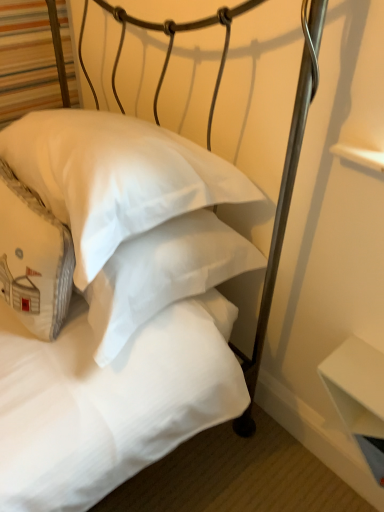
Question: From a real-world perspective, is white cotton pillow at center, marked as the 1th pillow in a left-to-right arrangement, physically below white matte pillow at center, the 1th pillow from the right?

Choices:
 (A) yes
 (B) no

Answer: (A)

Question: From the image's perspective, does white cotton pillow at center, which is the second pillow from right to left, appear higher than white matte pillow at center, placed as the 2th pillow when sorted from left to right?

Choices:
 (A) yes
 (B) no

Answer: (B)

Question: From the image's perspective, is white cotton pillow at center, marked as the 1th pillow in a left-to-right arrangement, under white matte pillow at center, placed as the 2th pillow when sorted from left to right?

Choices:
 (A) yes
 (B) no

Answer: (A)

Question: From a real-world perspective, does white cotton pillow at center, marked as the 1th pillow in a left-to-right arrangement, stand above white matte pillow at center, placed as the 2th pillow when sorted from left to right?

Choices:
 (A) yes
 (B) no

Answer: (B)

Question: Could white matte pillow at center, placed as the 2th pillow when sorted from left to right, be considered to be inside white cotton pillow at center, marked as the 1th pillow in a left-to-right arrangement?

Choices:
 (A) yes
 (B) no

Answer: (B)

Question: Considering the relative positions of white cotton pillow at center, marked as the 1th pillow in a left-to-right arrangement, and white matte pillow at center, placed as the 2th pillow when sorted from left to right, in the image provided, is white cotton pillow at center, marked as the 1th pillow in a left-to-right arrangement, to the right of white matte pillow at center, placed as the 2th pillow when sorted from left to right, from the viewer's perspective?

Choices:
 (A) no
 (B) yes

Answer: (A)

Question: Is white matte table at lower right next to white matte pillow at center, placed as the 2th pillow when sorted from left to right?

Choices:
 (A) yes
 (B) no

Answer: (B)

Question: From the image's perspective, does white matte table at lower right appear higher than white matte pillow at center, the 1th pillow from the right?

Choices:
 (A) no
 (B) yes

Answer: (A)

Question: From a real-world perspective, is white matte table at lower right positioned over white matte pillow at center, placed as the 2th pillow when sorted from left to right, based on gravity?

Choices:
 (A) yes
 (B) no

Answer: (B)

Question: Can you confirm if white matte table at lower right is wider than white matte pillow at center, the 1th pillow from the right?

Choices:
 (A) yes
 (B) no

Answer: (B)

Question: Is the position of white matte table at lower right less distant than that of white matte pillow at center, placed as the 2th pillow when sorted from left to right?

Choices:
 (A) yes
 (B) no

Answer: (B)

Question: From the image's perspective, does white matte table at lower right appear lower than white matte pillow at center, the 1th pillow from the right?

Choices:
 (A) yes
 (B) no

Answer: (A)

Question: Does white matte table at lower right come behind white cotton pillow at center, which is the second pillow from right to left?

Choices:
 (A) no
 (B) yes

Answer: (B)